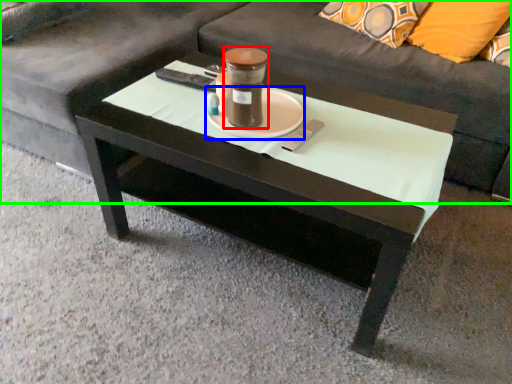
Question: Which is farther away from beverage (highlighted by a red box)? saucer (highlighted by a blue box) or studio couch (highlighted by a green box)?

Choices:
 (A) saucer
 (B) studio couch

Answer: (B)